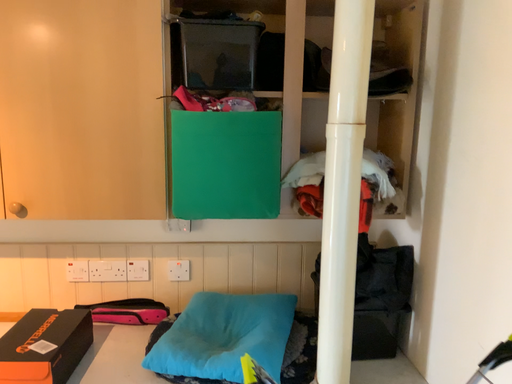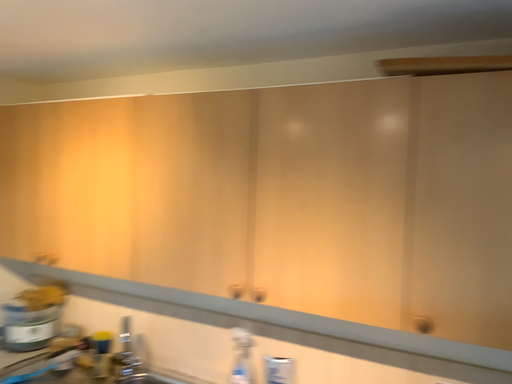
Question: Which way did the camera rotate in the video?

Choices:
 (A) rotated upward
 (B) rotated downward

Answer: (A)